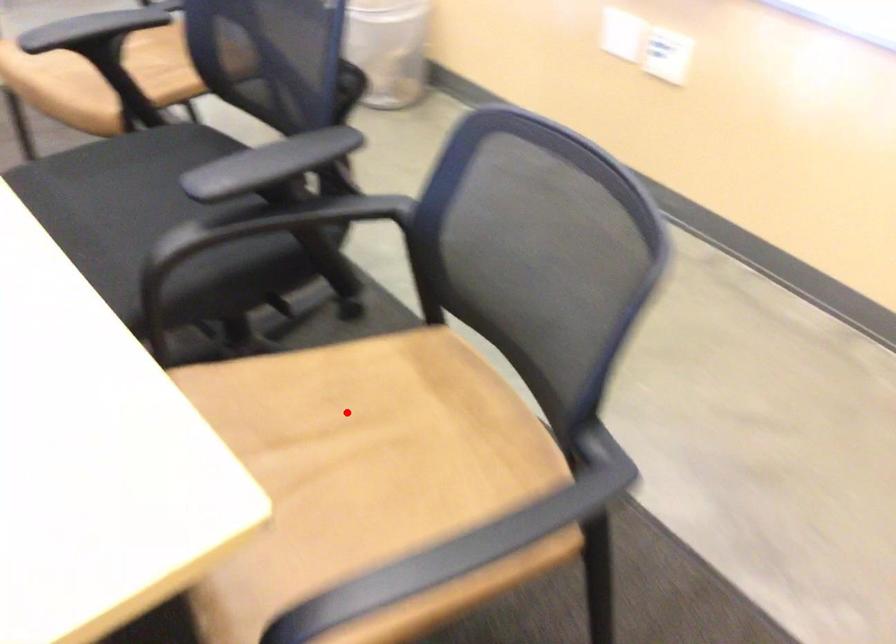
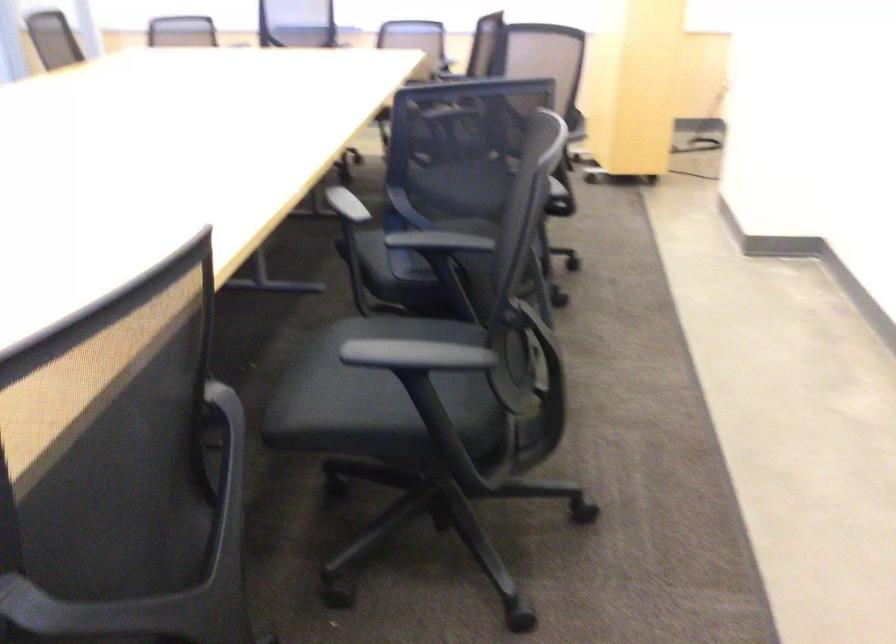
Question: I am providing you with two images of the same scene from different viewpoints. A red point is marked on the first image. Is the red point's position out of view in image 2?

Choices:
 (A) Yes
 (B) No

Answer: (A)